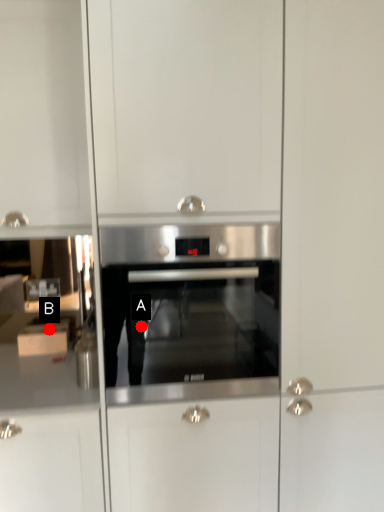
Question: Two points are circled on the image, labeled by A and B beside each circle. Among these points, which one is farthest from the camera?

Choices:
 (A) A is further
 (B) B is further

Answer: (B)